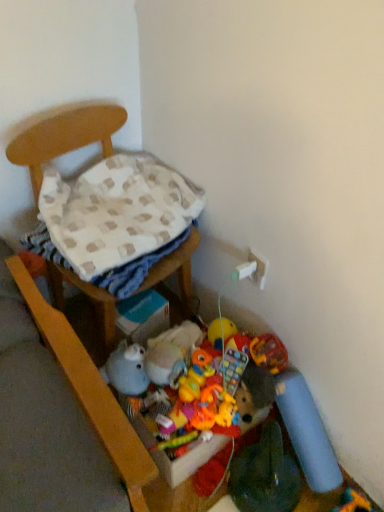
Question: Which direction should I rotate to look at soft plush duck at lower center, acting as the 2th toy starting from the left, — up or down?

Choices:
 (A) down
 (B) up

Answer: (A)

Question: Should I look upward or downward to see fuzzy fabric stuffed animal at lower center, the first toy viewed from the left?

Choices:
 (A) down
 (B) up

Answer: (A)

Question: Considering the relative positions of soft plush toy at lower right, positioned as the 1th toy in right-to-left order, and wooden chair at left in the image provided, is soft plush toy at lower right, positioned as the 1th toy in right-to-left order, in front of wooden chair at left?

Choices:
 (A) no
 (B) yes

Answer: (A)

Question: Is wooden chair at left completely or partially inside soft plush toy at lower right, the 4th toy positioned from the top?

Choices:
 (A) no
 (B) yes

Answer: (A)

Question: Does soft plush toy at lower right, positioned as the 1th toy in right-to-left order, appear on the left side of wooden chair at left?

Choices:
 (A) no
 (B) yes

Answer: (A)

Question: Does soft plush toy at lower right, which ranks as the fourth toy in left-to-right order, come behind wooden chair at left?

Choices:
 (A) yes
 (B) no

Answer: (A)

Question: From a real-world perspective, is soft plush toy at lower right, positioned as the 1th toy in right-to-left order, positioned under wooden chair at left based on gravity?

Choices:
 (A) yes
 (B) no

Answer: (A)

Question: Is soft plush toy at lower right, which ranks as the fourth toy in left-to-right order, beside wooden chair at left?

Choices:
 (A) no
 (B) yes

Answer: (A)

Question: Is soft plush toy at lower right, which ranks as the fourth toy in left-to-right order, at the back of beige checkered blanket at left?

Choices:
 (A) yes
 (B) no

Answer: (B)

Question: From a real-world perspective, is beige checkered blanket at left positioned over soft plush toy at lower right, which is the 1th toy from bottom to top, based on gravity?

Choices:
 (A) yes
 (B) no

Answer: (A)

Question: Is the position of beige checkered blanket at left less distant than that of soft plush toy at lower right, which ranks as the fourth toy in left-to-right order?

Choices:
 (A) yes
 (B) no

Answer: (B)

Question: Can you confirm if beige checkered blanket at left is wider than soft plush toy at lower right, the 4th toy positioned from the top?

Choices:
 (A) yes
 (B) no

Answer: (A)

Question: Is beige checkered blanket at left facing towards soft plush toy at lower right, the 4th toy positioned from the top?

Choices:
 (A) no
 (B) yes

Answer: (A)

Question: Is beige checkered blanket at left further to camera compared to soft plush toy at lower right, which ranks as the fourth toy in left-to-right order?

Choices:
 (A) yes
 (B) no

Answer: (A)

Question: From a real-world perspective, is rubberized plastic toy at center, which ranks as the second toy in right-to-left order, on top of fuzzy fabric stuffed animal at lower center, the 3th toy when ordered from bottom to top?

Choices:
 (A) no
 (B) yes

Answer: (A)